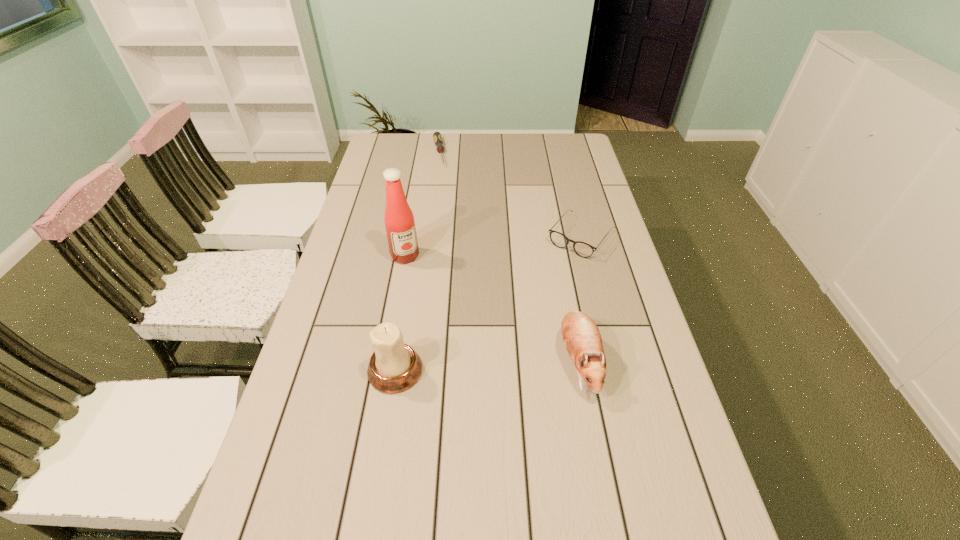
Locate an element on the screen. The width and height of the screenshot is (960, 540). free region located on the front-facing side of the tallest object is located at coordinates (449, 341).

Where is `free spot located through the lenses of the fourth tallest object`? The width and height of the screenshot is (960, 540). free spot located through the lenses of the fourth tallest object is located at coordinates [x=543, y=284].

At what (x,y) coordinates should I click in order to perform the action: click on free region located through the lenses of the fourth tallest object. Please return your answer as a coordinate pair (x, y). The width and height of the screenshot is (960, 540). Looking at the image, I should click on (555, 270).

Where is `vacant position located through the lenses of the fourth tallest object`? vacant position located through the lenses of the fourth tallest object is located at coordinates (517, 316).

Locate an element on the screen. vacant space located 0.180m insert the farthest object into a screw head is located at coordinates (444, 193).

Where is `vacant space located insert the farthest object into a screw head`? vacant space located insert the farthest object into a screw head is located at coordinates (451, 222).

Locate an element on the screen. vacant region located insert the farthest object into a screw head is located at coordinates (451, 222).

The width and height of the screenshot is (960, 540). I want to click on object that is at the far edge, so click(437, 136).

The image size is (960, 540). Find the location of `hamster present at the right edge`. hamster present at the right edge is located at coordinates (581, 336).

Locate an element on the screen. spectacles located in the right edge section of the desktop is located at coordinates (582, 249).